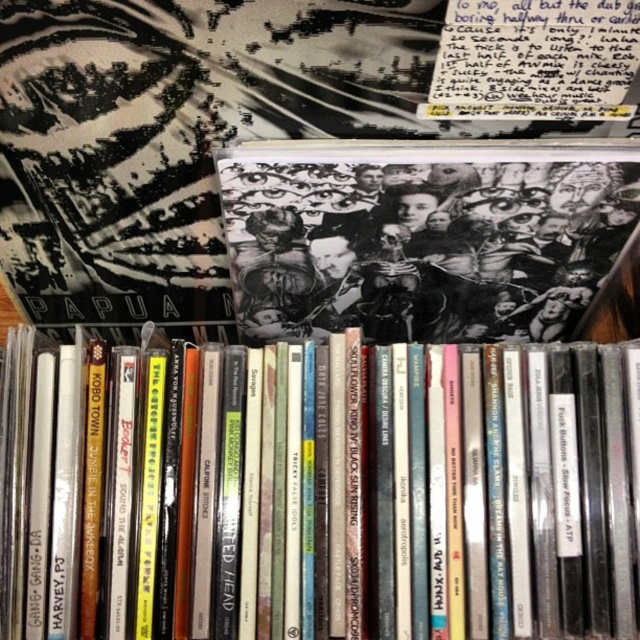
Consider the image. What is the difference between the matte black book at center and the black matte book at center in terms of their height?

The matte black book at center is much taller than the black matte book at center.

You are holding a measuring tape and need to determine if the matte black book at center is within reach. Your hand can extend 25 inches forward. Can you reach it?

The matte black book at center is 24.87 inches away from the viewer, which is within the 25 inch reach of your hand. Yes, you can reach it.

You are organizing a music collection and notice two books in the box. The first is a matte black book at center and the second is a black matte book at center. Which one is positioned to the left?

The matte black book at center is positioned to the left of the black matte book at center.